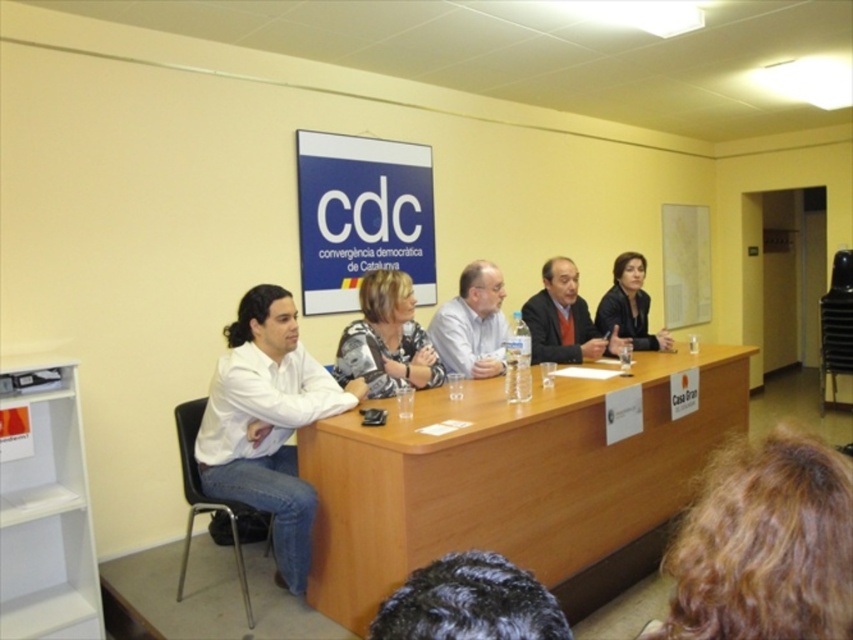
Does light brown wood table at center come in front of blonde curly hair at lower right?

No, light brown wood table at center is further to the viewer.

Does light brown wood table at center appear under blonde curly hair at lower right?

Yes, light brown wood table at center is below blonde curly hair at lower right.

Is point (347, 586) more distant than point (680, 538)?

No, it is not.

Where is `light brown wood table at center`? light brown wood table at center is located at coordinates (512, 481).

Which of these two, white shirt at center or matte orange shirt at center, stands taller?

Standing taller between the two is white shirt at center.

Is point (492, 307) less distant than point (561, 304)?

Yes, point (492, 307) is closer to viewer.

Find the location of `white shirt at center`. white shirt at center is located at coordinates (473, 324).

Is white shirt at center to the left of black leather jacket at center from the viewer's perspective?

Indeed, white shirt at center is positioned on the left side of black leather jacket at center.

Does white shirt at center have a lesser height compared to black leather jacket at center?

Indeed, white shirt at center has a lesser height compared to black leather jacket at center.

Locate an element on the screen. The height and width of the screenshot is (640, 853). white shirt at center is located at coordinates (473, 324).

Image resolution: width=853 pixels, height=640 pixels. In order to click on white shirt at center in this screenshot , I will do `click(473, 324)`.